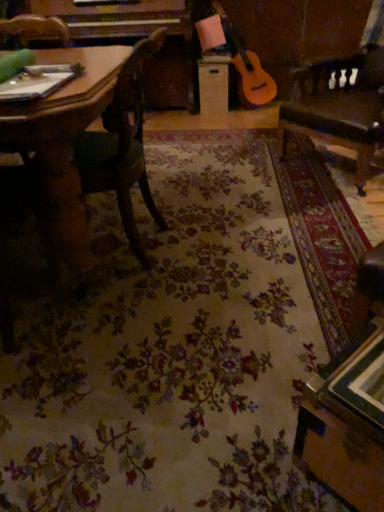
Question: Is wooden drawer at center in front of or behind wooden chair at left in the image?

Choices:
 (A) front
 (B) behind

Answer: (B)

Question: Is wooden drawer at center spatially inside wooden chair at left, or outside of it?

Choices:
 (A) inside
 (B) outside

Answer: (B)

Question: Based on their relative distances, which object is farther from the wooden drawer at center?

Choices:
 (A) wooden chair at left
 (B) leather swivel chair at right

Answer: (A)

Question: Which object is positioned closest to the leather swivel chair at right?

Choices:
 (A) wooden drawer at center
 (B) wooden chair at left

Answer: (B)